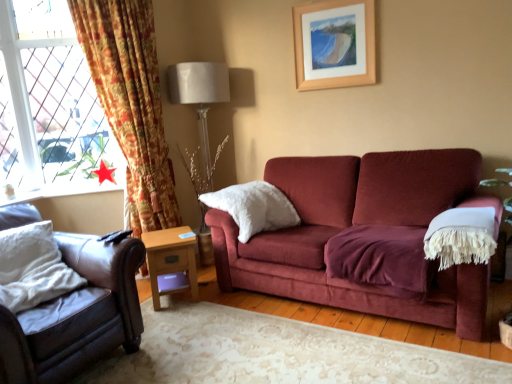
Question: Is floral fabric curtain at left outside wooden picture frame at upper center?

Choices:
 (A) yes
 (B) no

Answer: (A)

Question: Is floral fabric curtain at left taller than wooden picture frame at upper center?

Choices:
 (A) yes
 (B) no

Answer: (A)

Question: Is floral fabric curtain at left smaller than wooden picture frame at upper center?

Choices:
 (A) yes
 (B) no

Answer: (B)

Question: Is wooden picture frame at upper center surrounded by floral fabric curtain at left?

Choices:
 (A) yes
 (B) no

Answer: (B)

Question: Does floral fabric curtain at left have a greater width compared to wooden picture frame at upper center?

Choices:
 (A) yes
 (B) no

Answer: (A)

Question: Considering the relative positions of leather couch at left and white fluffy pillow at center, the 1th pillow in the right-to-left sequence, in the image provided, is leather couch at left to the left or to the right of white fluffy pillow at center, the 1th pillow in the right-to-left sequence,?

Choices:
 (A) left
 (B) right

Answer: (A)

Question: Is leather couch at left in front of or behind white fluffy pillow at center, arranged as the first pillow when viewed from the back, in the image?

Choices:
 (A) behind
 (B) front

Answer: (B)

Question: Is leather couch at left wider or thinner than white fluffy pillow at center, arranged as the first pillow when viewed from the back?

Choices:
 (A) wide
 (B) thin

Answer: (A)

Question: Considering the positions of leather couch at left and white fluffy pillow at center, arranged as the 2th pillow when viewed from the front, in the image, is leather couch at left bigger or smaller than white fluffy pillow at center, arranged as the 2th pillow when viewed from the front,?

Choices:
 (A) small
 (B) big

Answer: (B)

Question: Is wooden picture frame at upper center in front of or behind white fluffy pillow at center, the 1th pillow in the right-to-left sequence, in the image?

Choices:
 (A) front
 (B) behind

Answer: (B)

Question: Is wooden picture frame at upper center taller or shorter than white fluffy pillow at center, which appears as the 2th pillow when viewed from the left?

Choices:
 (A) short
 (B) tall

Answer: (B)

Question: Would you say wooden picture frame at upper center is inside or outside white fluffy pillow at center, arranged as the 2th pillow when viewed from the front?

Choices:
 (A) inside
 (B) outside

Answer: (B)

Question: Is wooden picture frame at upper center to the left or to the right of white fluffy pillow at center, which appears as the 2th pillow when viewed from the left, in the image?

Choices:
 (A) right
 (B) left

Answer: (A)

Question: From the image's perspective, is white soft pillow at left, the 2th pillow from the right, located above or below light brown wooden side table at lower center?

Choices:
 (A) below
 (B) above

Answer: (B)

Question: From a real-world perspective, is white soft pillow at left, which appears as the first pillow when viewed from the left, physically located above or below light brown wooden side table at lower center?

Choices:
 (A) below
 (B) above

Answer: (B)